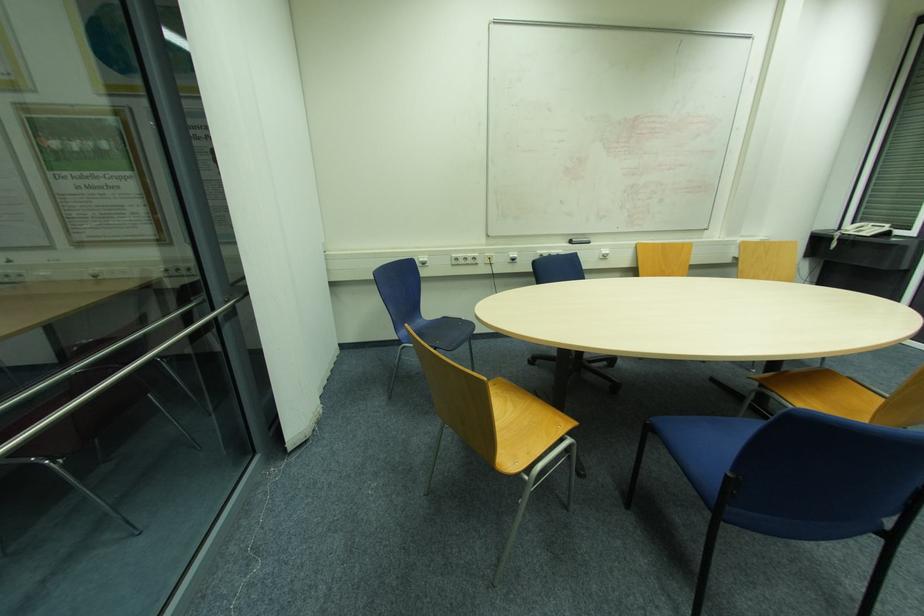
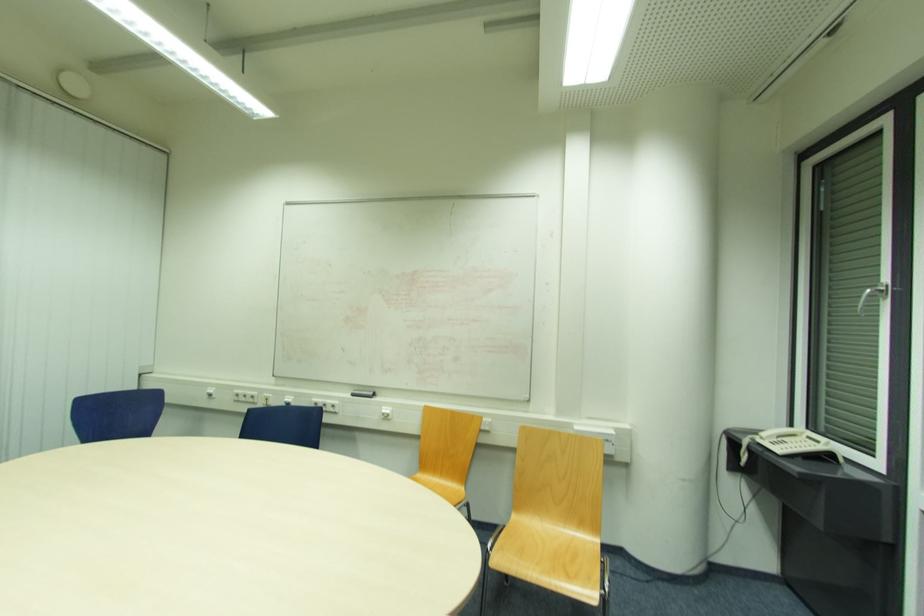
The point at (574,244) is marked in the first image. Where is the corresponding point in the second image?

(355, 395)